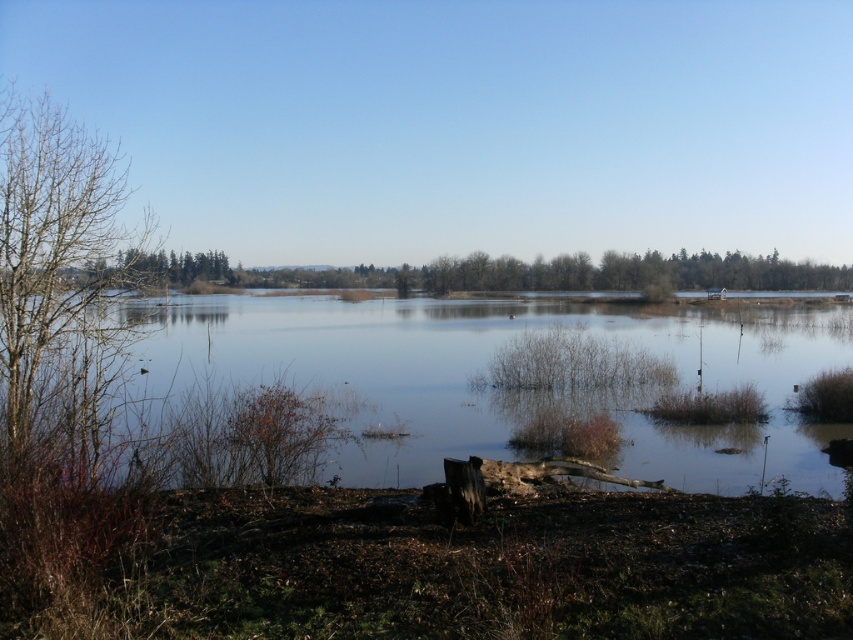
Question: Is clear water at center thinner than bare branches at left?

Choices:
 (A) no
 (B) yes

Answer: (A)

Question: Can you confirm if clear water at center is positioned below bare branches at left?

Choices:
 (A) no
 (B) yes

Answer: (B)

Question: Among these objects, which one is farthest from the camera?

Choices:
 (A) bare branches at left
 (B) clear water at center

Answer: (B)

Question: Can you confirm if clear water at center is positioned below bare branches at left?

Choices:
 (A) no
 (B) yes

Answer: (B)

Question: Which object is farther from the camera taking this photo?

Choices:
 (A) bare branches at left
 (B) clear water at center

Answer: (B)

Question: Which point appears farthest from the camera in this image?

Choices:
 (A) (10, 426)
 (B) (286, 358)

Answer: (B)